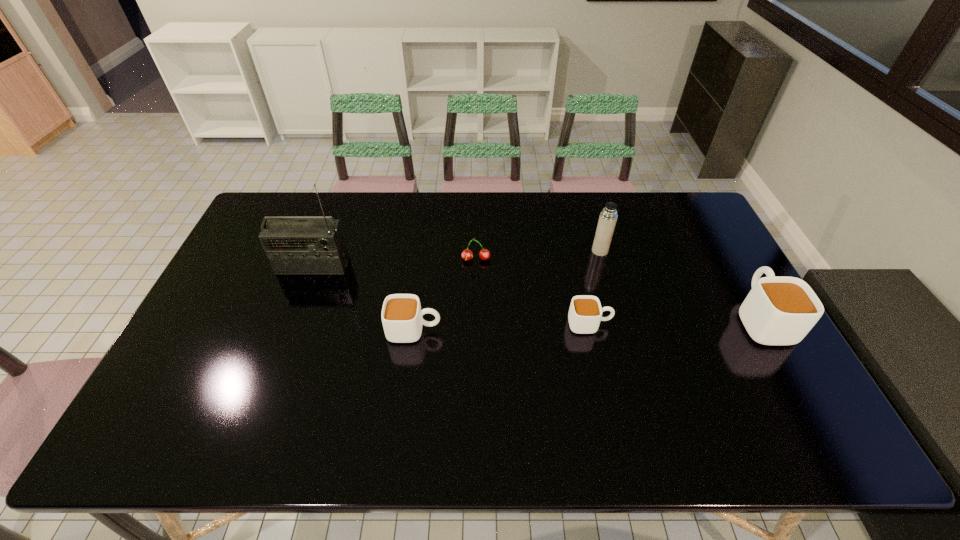
What are the coordinates of `vacant space located on the side with the handle of the shortest cup` in the screenshot? It's located at (668, 324).

Locate an element on the screen. vacant area situated on the side with the handle of the fourth shortest object is located at coordinates (737, 276).

Locate an element on the screen. Image resolution: width=960 pixels, height=540 pixels. free space located 0.150m on the side with the handle of the fourth shortest object is located at coordinates (726, 256).

Find the location of a particular element. free region located 0.280m on the side with the handle of the fourth shortest object is located at coordinates (711, 231).

Identify the location of vacant area located 0.160m on the back of the fifth shortest object. The width and height of the screenshot is (960, 540). (590, 215).

I want to click on free space located with stems pointing upwards on the cherry, so click(x=475, y=321).

Image resolution: width=960 pixels, height=540 pixels. Identify the location of free space located on the front panel of the tallest object. (276, 363).

The width and height of the screenshot is (960, 540). In order to click on object located at the left edge in this screenshot , I will do `click(293, 244)`.

Where is `object that is at the right edge`? This screenshot has width=960, height=540. object that is at the right edge is located at coordinates (778, 310).

Locate an element on the screen. vacant space at the far edge of the desktop is located at coordinates (421, 193).